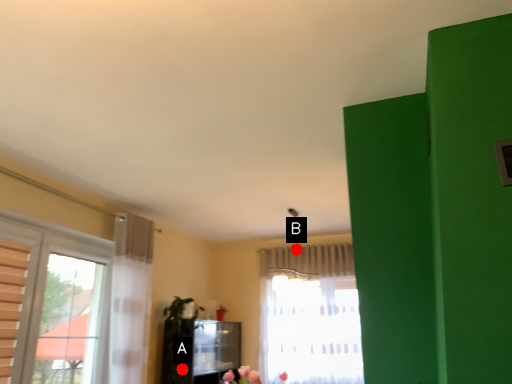
Question: Two points are circled on the image, labeled by A and B beside each circle. Which of the following is the closest to the observer?

Choices:
 (A) A is closer
 (B) B is closer

Answer: (A)